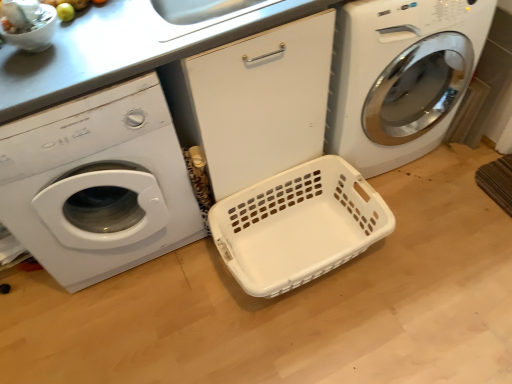
I want to click on free region under white plastic basket at center (from a real-world perspective), so click(300, 248).